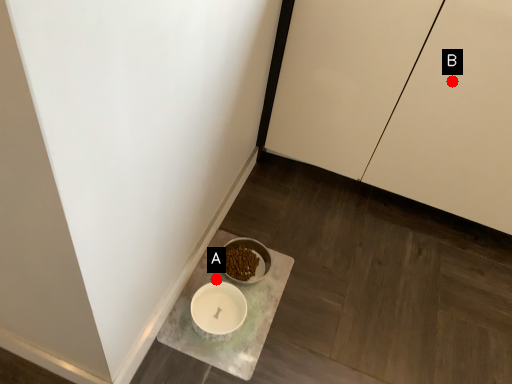
Question: Two points are circled on the image, labeled by A and B beside each circle. Which point appears closest to the camera in this image?

Choices:
 (A) A is closer
 (B) B is closer

Answer: (B)